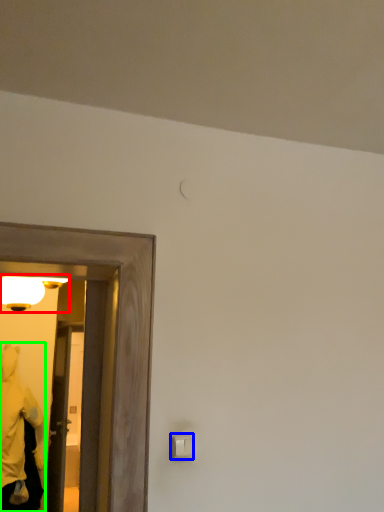
Question: Based on their relative distances, which object is farther from light fixture (highlighted by a red box)? Choose from light switch (highlighted by a blue box) and person (highlighted by a green box).

Choices:
 (A) light switch
 (B) person

Answer: (A)